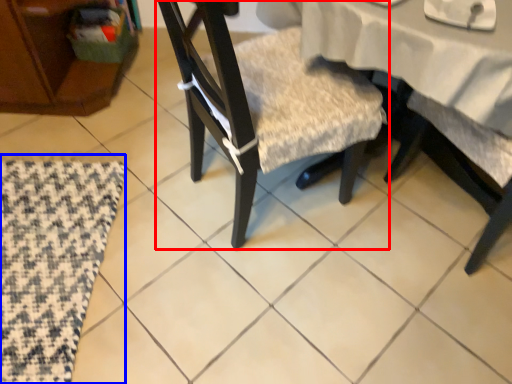
Question: Among these objects, which one is nearest to the camera, chair (highlighted by a red box) or mat (highlighted by a blue box)?

Choices:
 (A) chair
 (B) mat

Answer: (A)